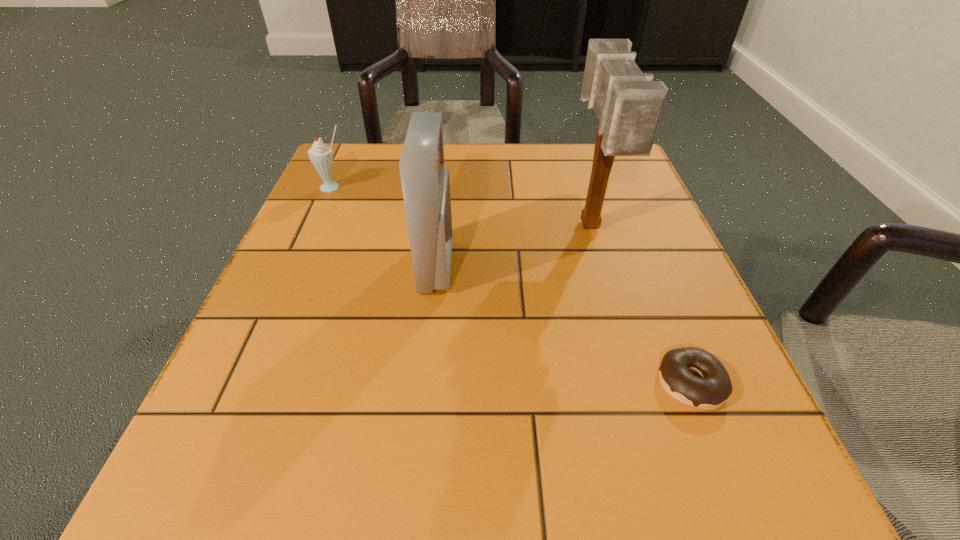
At what (x,y) coordinates should I click in order to perform the action: click on vacant space at the left edge of the desktop. Please return your answer as a coordinate pair (x, y). The width and height of the screenshot is (960, 540). Looking at the image, I should click on (322, 223).

The image size is (960, 540). Identify the location of vacant space at the right edge of the desktop. (599, 267).

In the image, there is a desktop. Identify the location of vacant space at the far left corner. coord(345,176).

This screenshot has width=960, height=540. In order to click on vacant space at the near left corner in this screenshot , I will do `click(307, 506)`.

This screenshot has width=960, height=540. In order to click on vacant space at the far right corner in this screenshot , I will do `click(579, 158)`.

Image resolution: width=960 pixels, height=540 pixels. Identify the location of vacant point located between the doughnut and the mallet. (640, 305).

The height and width of the screenshot is (540, 960). What are the coordinates of `unoccupied position between the farthest object and the mallet` in the screenshot? It's located at (462, 207).

I want to click on free space between the third shortest object and the mallet, so click(514, 246).

I want to click on free area in between the first-aid kit and the farthest object, so click(x=385, y=226).

At what (x,y) coordinates should I click in order to perform the action: click on unoccupied area between the tallest object and the farthest object. Please return your answer as a coordinate pair (x, y). The image size is (960, 540). Looking at the image, I should click on (462, 207).